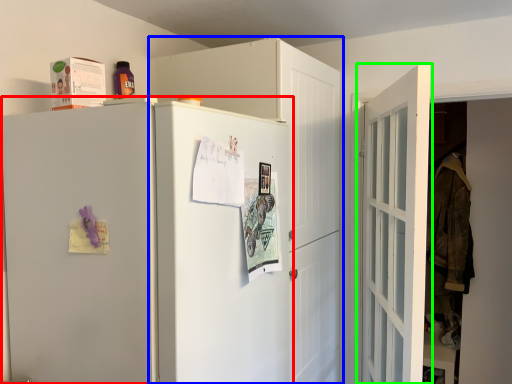
Question: Considering the real-world distances, which object is closest to refrigerator (highlighted by a red box)? cabinetry (highlighted by a blue box) or door (highlighted by a green box).

Choices:
 (A) cabinetry
 (B) door

Answer: (A)